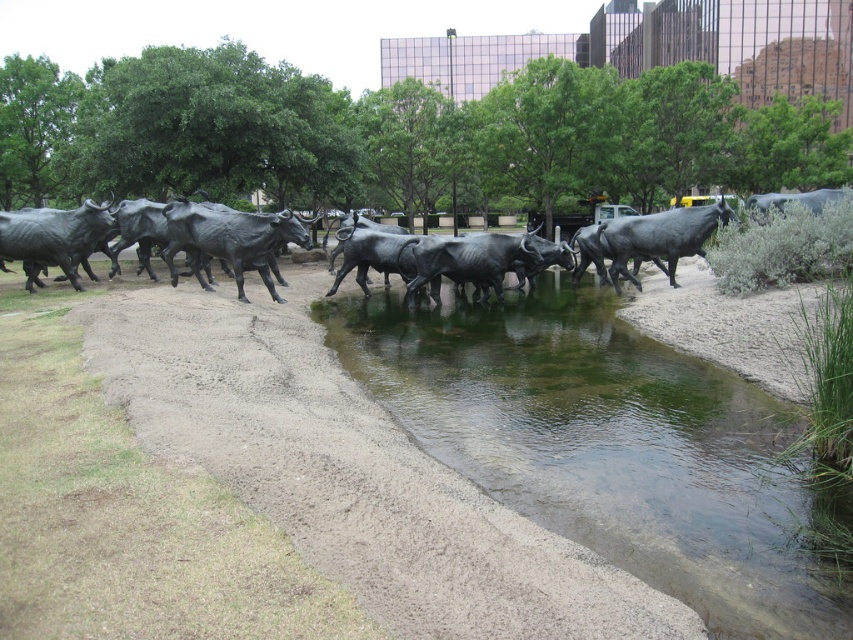
Can you confirm if clear water at center is thinner than polished bronze bull at center?

No.

Is clear water at center taller than polished bronze bull at center?

No.

Locate an element on the screen. This screenshot has height=640, width=853. clear water at center is located at coordinates 606,444.

Who is more distant from viewer, (42, 236) or (637, 288)?

The point (637, 288) is more distant.

Can you confirm if polished bronze bull at left is taller than polished bronze bull at right?

Yes.

Between point (74, 209) and point (612, 221), which one is positioned behind?

The point (74, 209) is more distant.

In order to click on polished bronze bull at left in this screenshot , I will do `click(51, 236)`.

Who is positioned more to the right, clear water at center or polished bronze bull at left?

clear water at center is more to the right.

Find the location of a particular element. The width and height of the screenshot is (853, 640). clear water at center is located at coordinates (606, 444).

Is point (738, 449) farther from viewer compared to point (79, 236)?

No, (738, 449) is closer to viewer.

The width and height of the screenshot is (853, 640). I want to click on clear water at center, so click(606, 444).